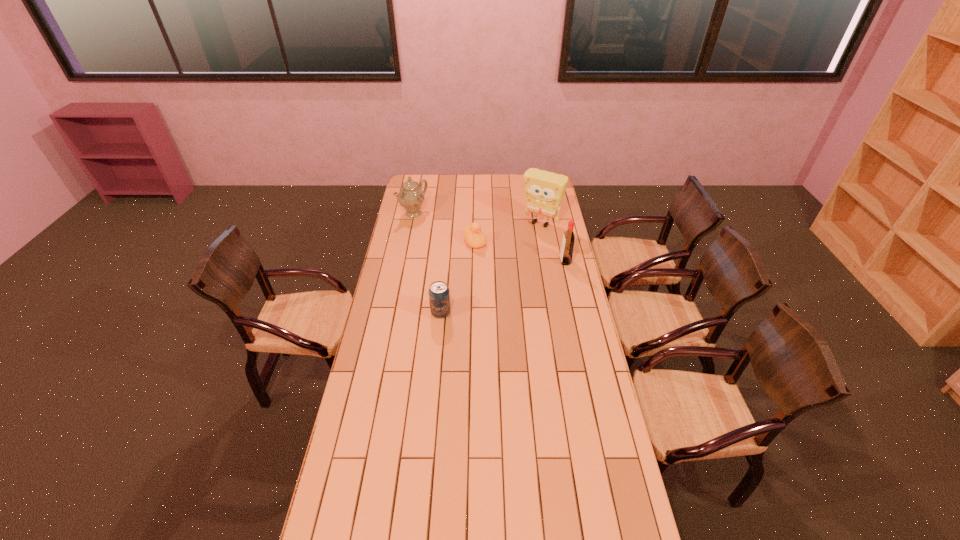
You are a GUI agent. You are given a task and a screenshot of the screen. Output one action in this format:
    pyautogui.click(x=<x>, y=<y>)
    Task: Click on the vacant space located on the front and back of the vodka
    This screenshot has width=960, height=540.
    Given the screenshot: What is the action you would take?
    pyautogui.click(x=540, y=261)

Find the location of a particular element. free space located 0.400m on the face of the third nearest object is located at coordinates (525, 296).

Find the location of a particular element. Image resolution: width=960 pixels, height=540 pixels. free space located on the face of the third nearest object is located at coordinates (503, 273).

This screenshot has width=960, height=540. I want to click on free space located 0.100m on the face of the third nearest object, so click(491, 260).

At what (x,y) coordinates should I click in order to perform the action: click on free point located 0.330m on the face of the tallest object. Please return your answer as a coordinate pair (x, y). The height and width of the screenshot is (540, 960). Looking at the image, I should click on (507, 266).

Where is `vacant space situated 0.250m on the face of the tallest object`? The width and height of the screenshot is (960, 540). vacant space situated 0.250m on the face of the tallest object is located at coordinates (514, 257).

Find the location of a particular element. This screenshot has width=960, height=540. free region located on the face of the tallest object is located at coordinates (508, 265).

Locate an element on the screen. free location located on the spout of the chinaware is located at coordinates (460, 242).

You are a GUI agent. You are given a task and a screenshot of the screen. Output one action in this format:
    pyautogui.click(x=<x>, y=<y>)
    Task: Click on the blank area located 0.110m on the spout of the chinaware
    The height and width of the screenshot is (540, 960).
    Given the screenshot: What is the action you would take?
    pyautogui.click(x=436, y=227)

Locate an element on the screen. vacant area located 0.210m on the spout of the chinaware is located at coordinates (448, 235).